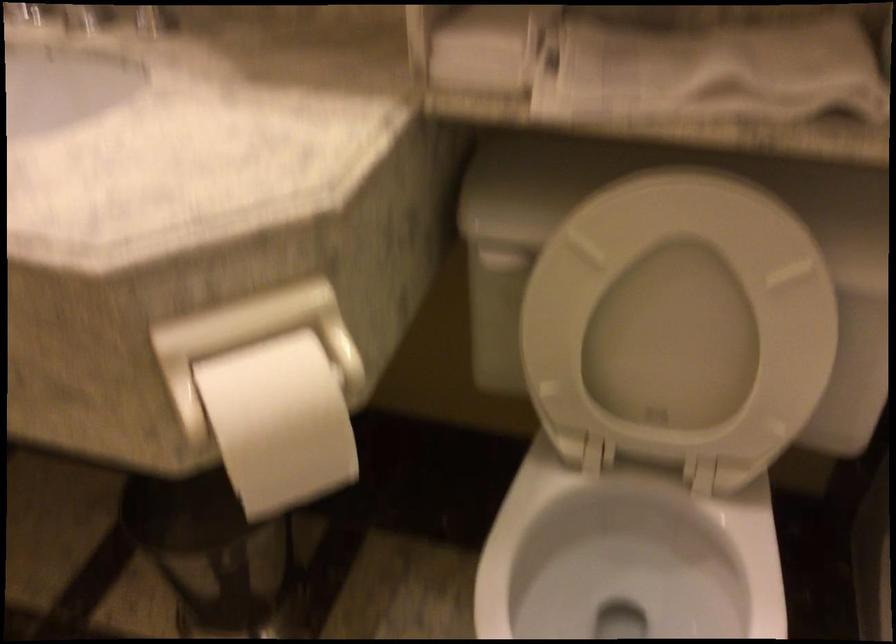
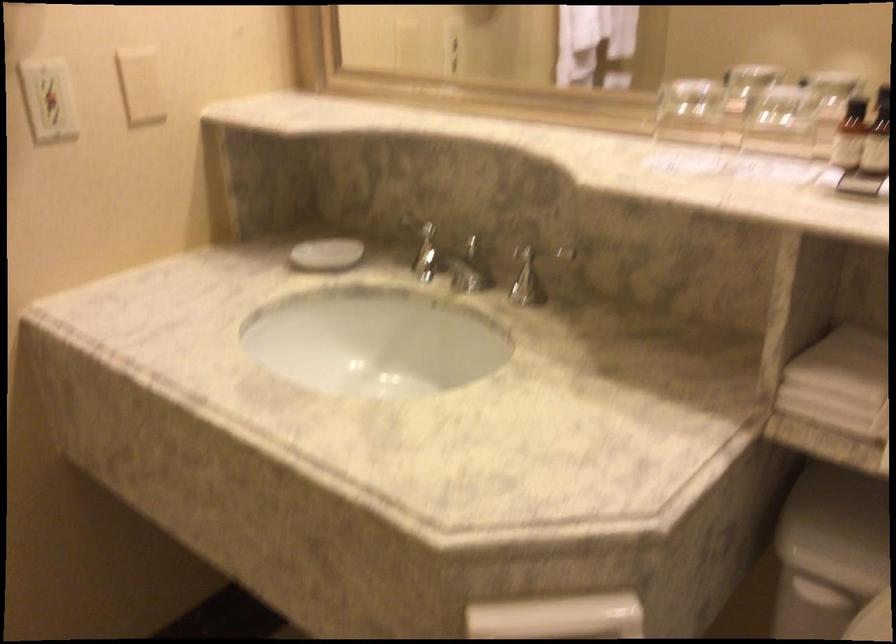
Question: Based on the continuous images, in which direction is the camera rotating? Reply with the corresponding letter.

Choices:
 (A) Left
 (B) Right
 (C) Up
 (D) Down

Answer: (A)